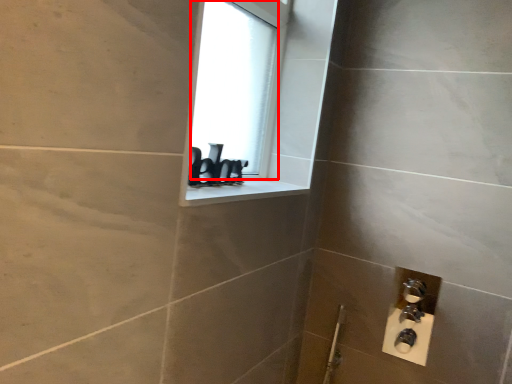
Question: From the image's perspective, what is the correct spatial relationship of window screen (annotated by the red box) in relation to window sill?

Choices:
 (A) above
 (B) below

Answer: (A)